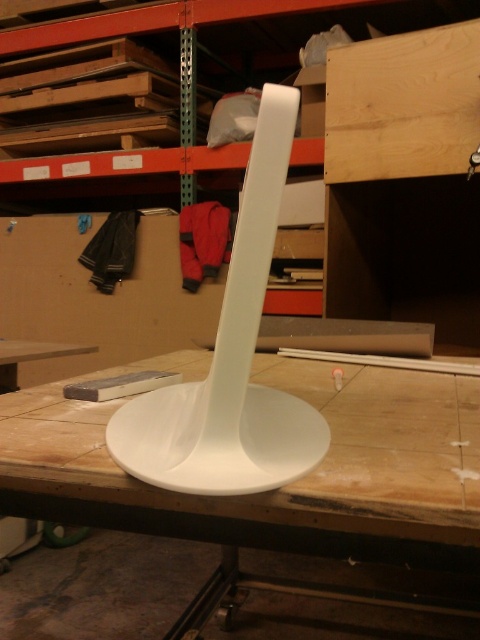
Is white matte table at center behind light brown wood at upper right?

No.

Does point (51, 460) lie behind point (447, 173)?

No, (51, 460) is in front of (447, 173).

Between point (448, 554) and point (421, 88), which one is positioned behind?

Point (421, 88)

Find the location of a particular element. white matte table at center is located at coordinates 282,486.